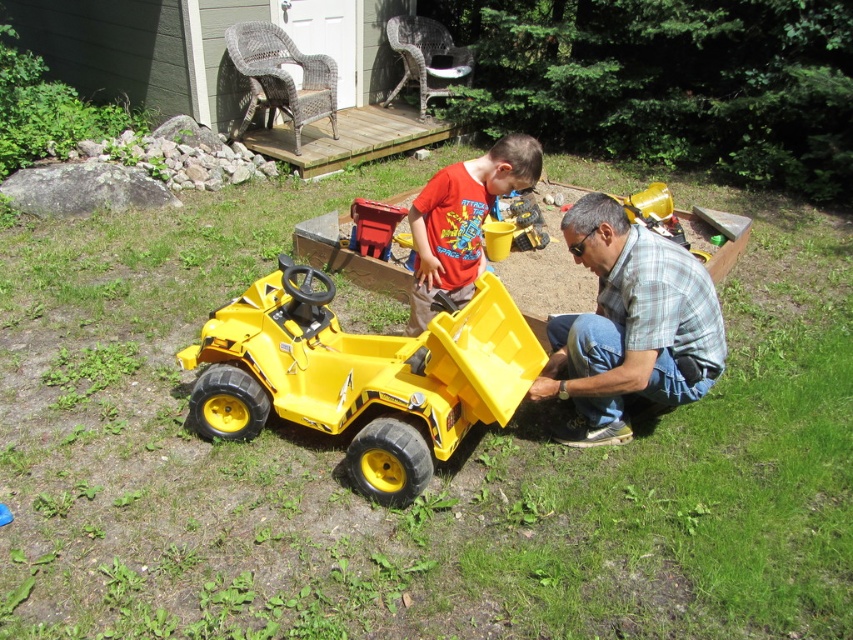
Question: Which object appears closest to the camera in this image?

Choices:
 (A) plaid shirt at lower right
 (B) matte red shirt at center

Answer: (A)

Question: Is yellow plastic toy car at center thinner than matte red shirt at center?

Choices:
 (A) no
 (B) yes

Answer: (A)

Question: Is yellow plastic toy car at center wider than plaid shirt at lower right?

Choices:
 (A) no
 (B) yes

Answer: (B)

Question: Estimate the real-world distances between objects in this image. Which object is closer to the plaid shirt at lower right?

Choices:
 (A) yellow plastic toy car at center
 (B) matte red shirt at center

Answer: (A)

Question: Is yellow plastic toy car at center further to the viewer compared to matte red shirt at center?

Choices:
 (A) yes
 (B) no

Answer: (B)

Question: Which object is closer to the camera taking this photo?

Choices:
 (A) yellow plastic toy car at center
 (B) matte red shirt at center
 (C) plaid shirt at lower right

Answer: (A)